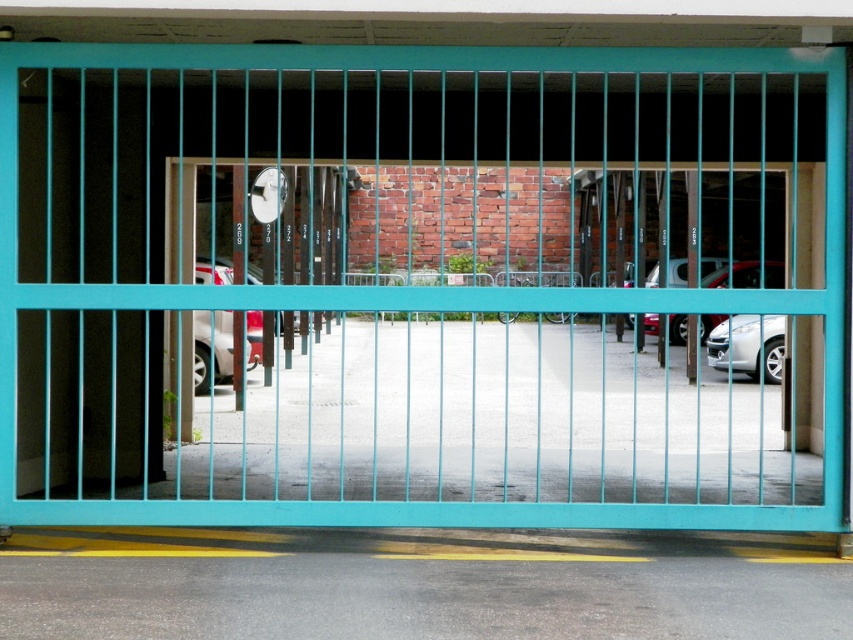
The image size is (853, 640). Describe the element at coordinates (212, 349) in the screenshot. I see `white glossy car at center` at that location.

Can you confirm if white glossy car at center is positioned to the left of silver metallic sedan at center?

Correct, you'll find white glossy car at center to the left of silver metallic sedan at center.

This screenshot has height=640, width=853. Identify the location of white glossy car at center. (212, 349).

Is white glossy car at center smaller than satin silver car at center?

No.

Describe the element at coordinates (212, 349) in the screenshot. The width and height of the screenshot is (853, 640). I see `white glossy car at center` at that location.

Is point (212, 376) in front of point (759, 355)?

Yes, point (212, 376) is closer to viewer.

In order to click on white glossy car at center in this screenshot , I will do `click(212, 349)`.

Who is positioned more to the right, satin silver car at center or silver metallic sedan at center?

silver metallic sedan at center

Who is higher up, satin silver car at center or silver metallic sedan at center?

silver metallic sedan at center is above.

Which is in front, point (780, 336) or point (668, 332)?

Positioned in front is point (780, 336).

The width and height of the screenshot is (853, 640). In order to click on satin silver car at center in this screenshot , I will do `click(747, 346)`.